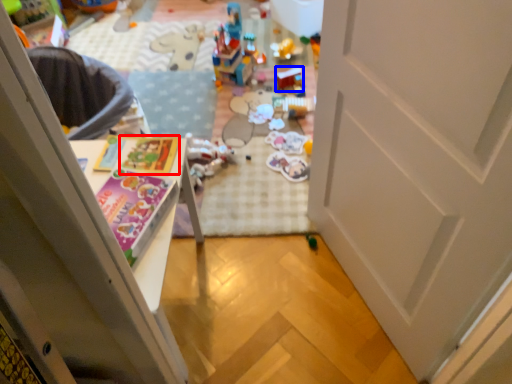
Question: Which object is further to the camera taking this photo, magazine (highlighted by a red box) or toy (highlighted by a blue box)?

Choices:
 (A) magazine
 (B) toy

Answer: (B)